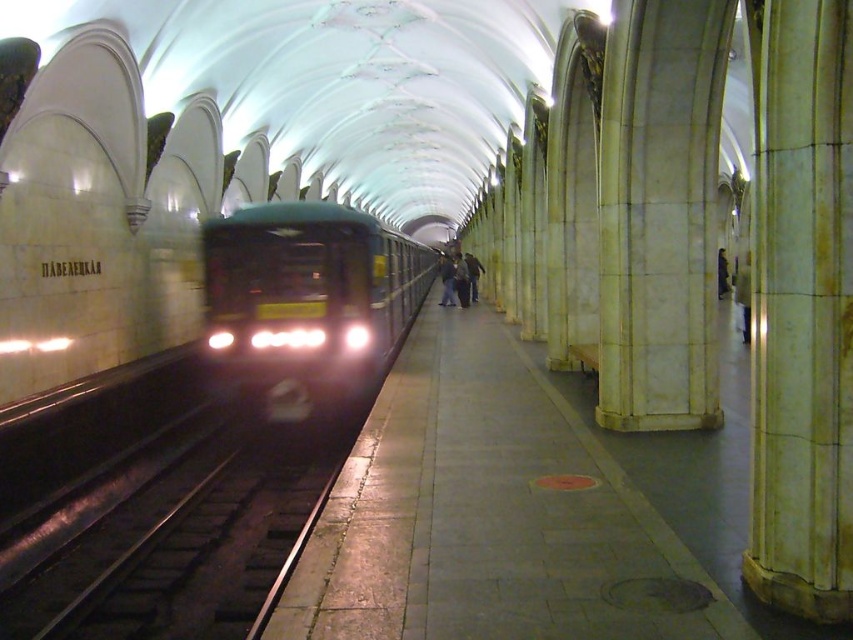
Question: Which object is positioned closest to the metal/smooth train track at center?

Choices:
 (A) white marble pillar at right
 (B) dark green metallic train at center

Answer: (A)

Question: Estimate the real-world distances between objects in this image. Which object is closer to the dark green metallic train at center?

Choices:
 (A) white marble pillar at right
 (B) metal/smooth train track at center

Answer: (B)

Question: Among these points, which one is farthest from the camera?

Choices:
 (A) (404, 298)
 (B) (244, 570)

Answer: (A)

Question: Does white marble pillar at right appear under dark green metallic train at center?

Choices:
 (A) no
 (B) yes

Answer: (B)

Question: Can you confirm if metal/smooth train track at center is positioned to the left of dark green metallic train at center?

Choices:
 (A) no
 (B) yes

Answer: (A)

Question: Does white marble pillar at right have a greater width compared to dark green metallic train at center?

Choices:
 (A) yes
 (B) no

Answer: (B)